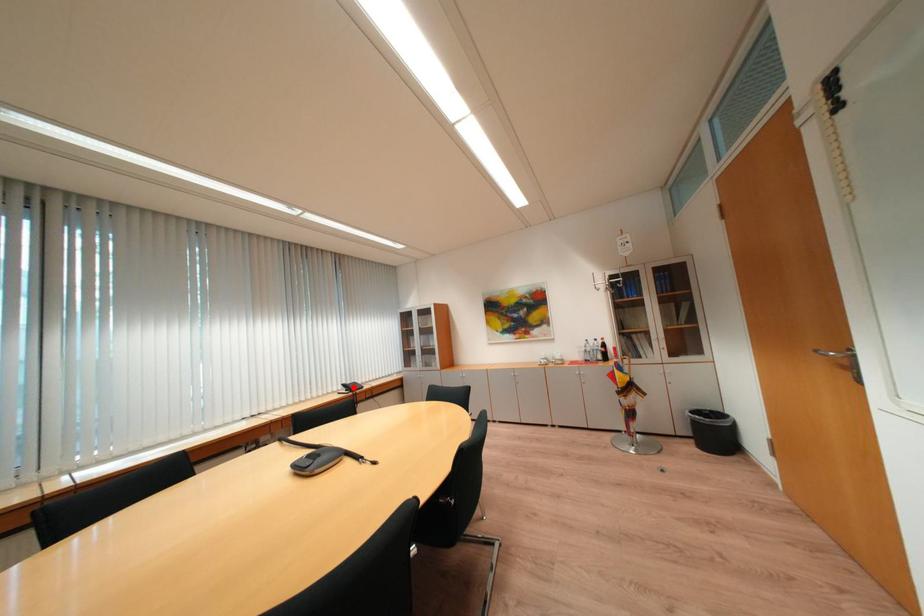
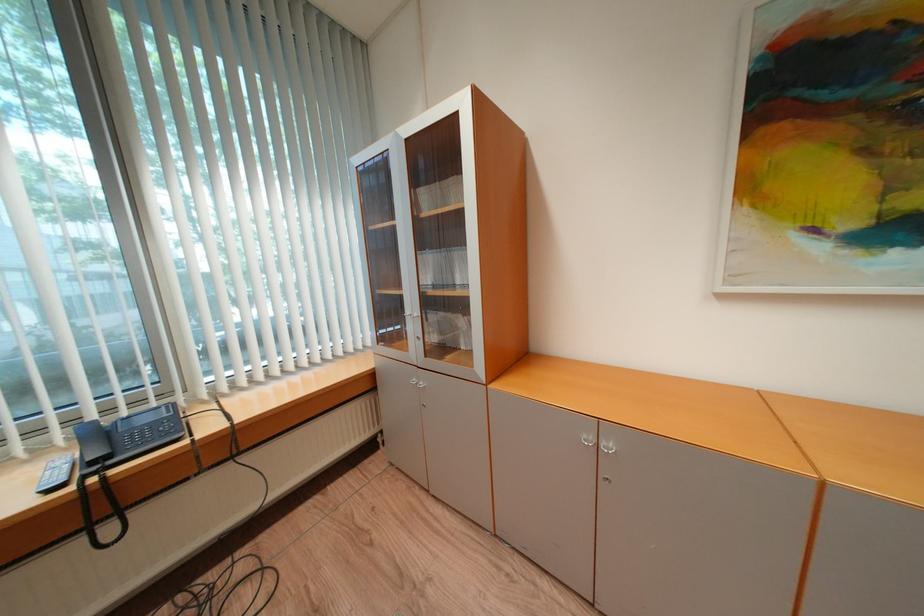
Locate, in the second image, the point that corresponds to the highlighted location in the first image.

(104, 434)